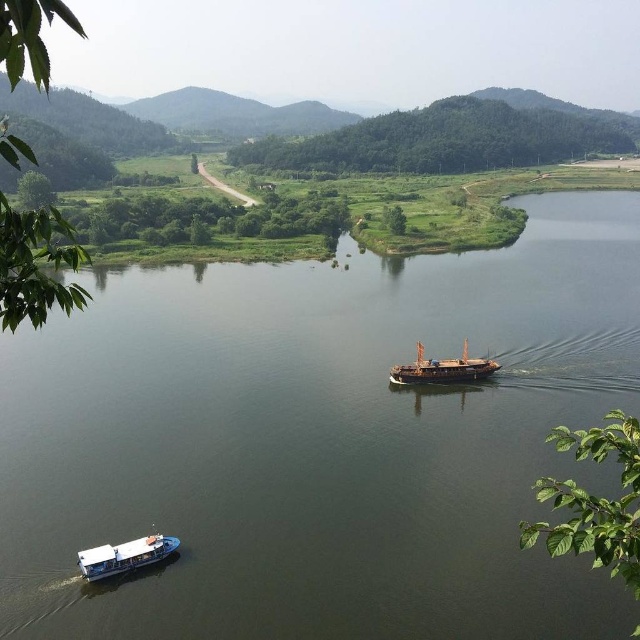
Between white matte boat at lower left and wooden ship at center, which one has less height?

With less height is white matte boat at lower left.

Between point (136, 540) and point (486, 368), which one is positioned in front?

Point (136, 540) is in front.

Who is more forward, (104, 568) or (472, 372)?

Point (104, 568) is more forward.

Where is `white matte boat at lower left`? The image size is (640, 640). white matte boat at lower left is located at coordinates (124, 556).

Does green grassy river at center have a greater width compared to wooden ship at center?

Yes, green grassy river at center is wider than wooden ship at center.

What are the coordinates of `green grassy river at center` in the screenshot? It's located at (321, 442).

Is green grassy river at center bigger than white matte boat at lower left?

Yes, green grassy river at center is bigger than white matte boat at lower left.

Is point (17, 484) positioned before point (112, 560)?

No, it is behind (112, 560).

The height and width of the screenshot is (640, 640). What are the coordinates of `green grassy river at center` in the screenshot? It's located at (321, 442).